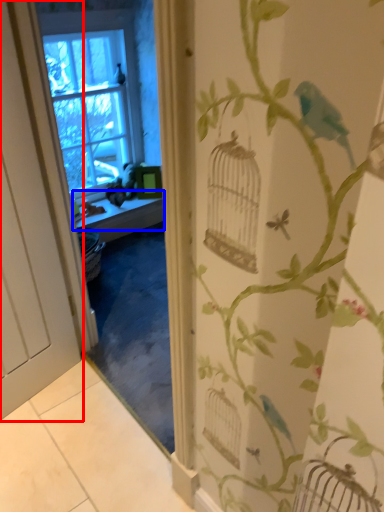
Question: Which of the following is the closest to the observer, door (highlighted by a red box) or window sill (highlighted by a blue box)?

Choices:
 (A) door
 (B) window sill

Answer: (A)